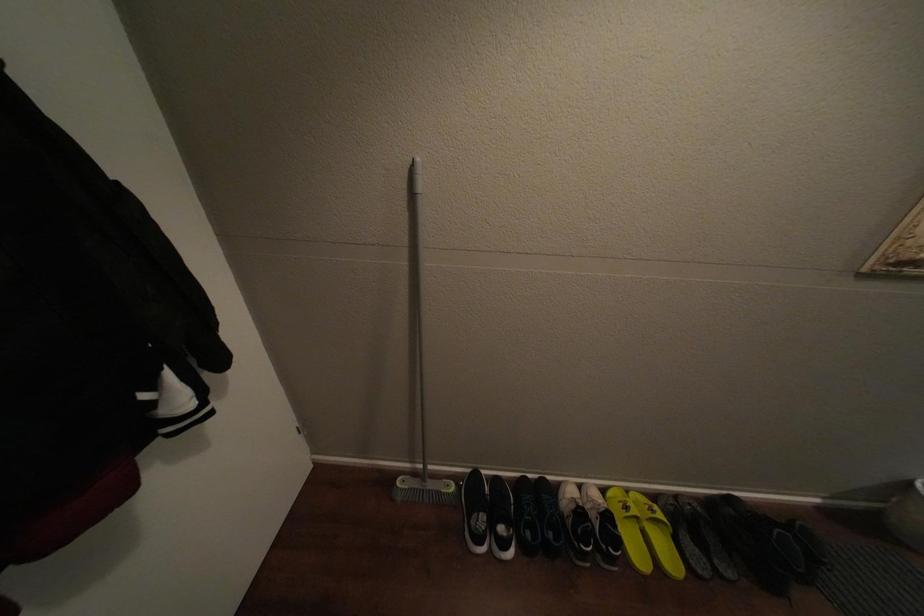
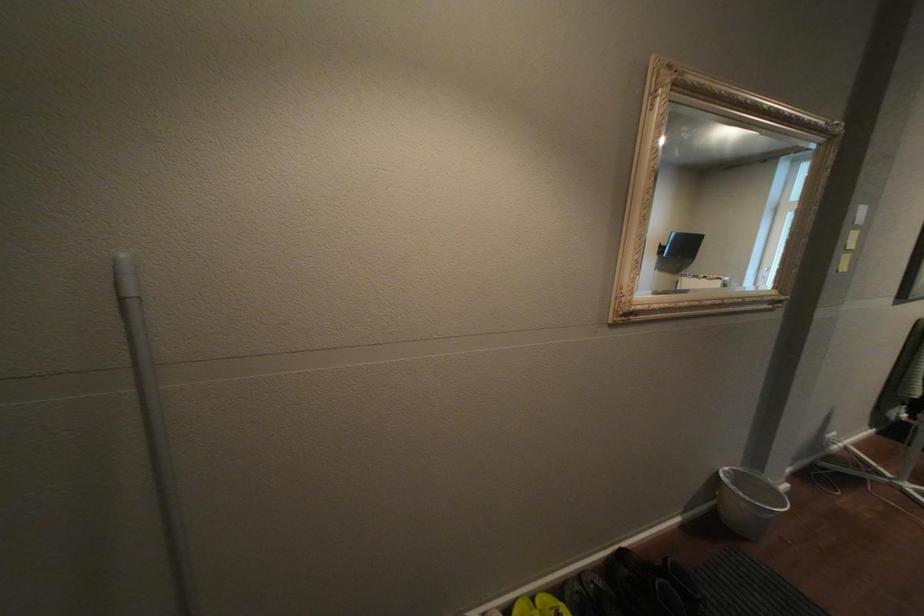
Question: The images are taken continuously from a first-person perspective. In which direction is your viewpoint rotating?

Choices:
 (A) Left
 (B) Right
 (C) Up
 (D) Down

Answer: (B)